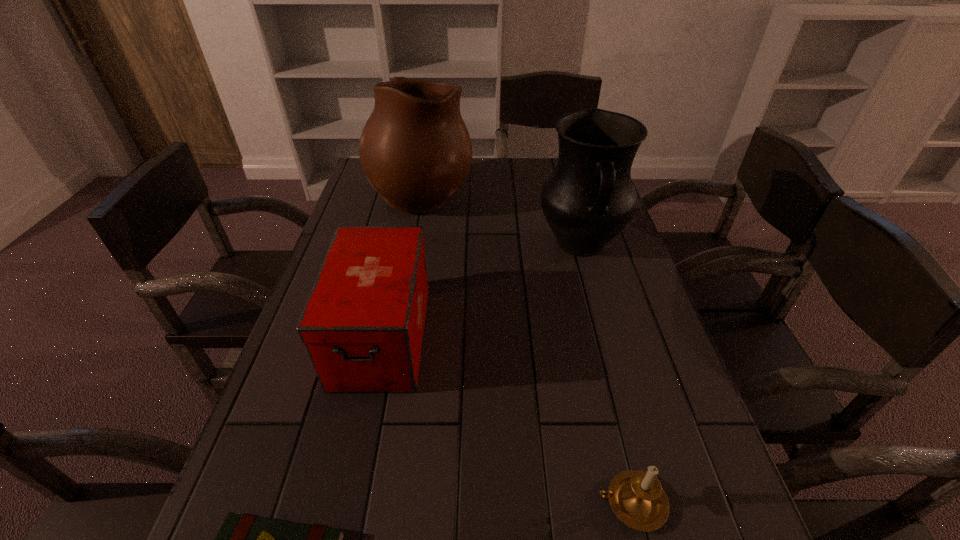
Where is `free space located with a handle on the side of the fourth tallest object`? The height and width of the screenshot is (540, 960). free space located with a handle on the side of the fourth tallest object is located at coordinates (502, 503).

Locate an element on the screen. This screenshot has height=540, width=960. object that is positioned at the far edge is located at coordinates (415, 150).

Image resolution: width=960 pixels, height=540 pixels. Identify the location of cream pitcher located in the left edge section of the desktop. (415, 150).

Find the location of `the first-aid kit at the left edge`. the first-aid kit at the left edge is located at coordinates (363, 323).

Where is `pitcher that is at the right edge`? The image size is (960, 540). pitcher that is at the right edge is located at coordinates (589, 198).

Identify the location of candle holder present at the right edge. The width and height of the screenshot is (960, 540). (636, 497).

Where is `object present at the far left corner`? object present at the far left corner is located at coordinates (415, 150).

The height and width of the screenshot is (540, 960). In the image, there is a desktop. In order to click on vacant space at the left edge in this screenshot , I will do tap(316, 441).

In the image, there is a desktop. At what (x,y) coordinates should I click in order to perform the action: click on vacant space at the right edge. Please return your answer as a coordinate pair (x, y). Image resolution: width=960 pixels, height=540 pixels. Looking at the image, I should click on (637, 374).

Locate an element on the screen. The width and height of the screenshot is (960, 540). unoccupied area between the pitcher and the third shortest object is located at coordinates (481, 290).